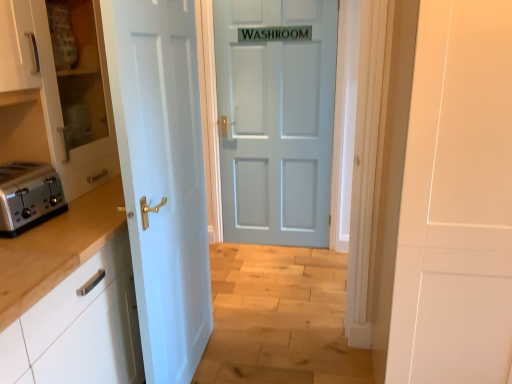
Question: Is white glossy cabinet at left, acting as the second cabinetry starting from the top, shorter than light blue matte door at center, the 2th door positioned from the front?

Choices:
 (A) yes
 (B) no

Answer: (A)

Question: Does white glossy cabinet at left, the 1th cabinetry ordered from the bottom, have a greater height compared to light blue matte door at center, placed as the second door when sorted from left to right?

Choices:
 (A) no
 (B) yes

Answer: (A)

Question: Is white glossy cabinet at left, acting as the second cabinetry starting from the top, oriented away from light blue matte door at center, placed as the second door when sorted from left to right?

Choices:
 (A) no
 (B) yes

Answer: (A)

Question: Can light blue matte door at center, positioned as the 1th door in right-to-left order, be found inside white glossy cabinet at left, acting as the second cabinetry starting from the top?

Choices:
 (A) no
 (B) yes

Answer: (A)

Question: Is white glossy cabinet at left, acting as the second cabinetry starting from the top, beside light blue matte door at center, the 2th door positioned from the front?

Choices:
 (A) no
 (B) yes

Answer: (A)

Question: Is white glossy cabinet at left, the 1th cabinetry ordered from the bottom, to the left of light blue matte door at center, positioned as the 1th door in right-to-left order, from the viewer's perspective?

Choices:
 (A) no
 (B) yes

Answer: (B)

Question: Is light blue matte door at center, placed as the second door when sorted from left to right, looking in the opposite direction of satin silver toaster at left?

Choices:
 (A) no
 (B) yes

Answer: (A)

Question: From the image's perspective, would you say light blue matte door at center, positioned as the 1th door in right-to-left order, is positioned over satin silver toaster at left?

Choices:
 (A) no
 (B) yes

Answer: (B)

Question: Would you say satin silver toaster at left is part of light blue matte door at center, positioned as the 1th door in right-to-left order,'s contents?

Choices:
 (A) no
 (B) yes

Answer: (A)

Question: Considering the relative sizes of light blue matte door at center, placed as the second door when sorted from left to right, and satin silver toaster at left in the image provided, is light blue matte door at center, placed as the second door when sorted from left to right, wider than satin silver toaster at left?

Choices:
 (A) no
 (B) yes

Answer: (A)

Question: Would you consider light blue matte door at center, placed as the second door when sorted from left to right, to be distant from satin silver toaster at left?

Choices:
 (A) no
 (B) yes

Answer: (B)

Question: Can you confirm if light blue matte door at center, placed as the second door when sorted from left to right, is shorter than satin silver toaster at left?

Choices:
 (A) yes
 (B) no

Answer: (B)

Question: Is white painted wood door at left, which ranks as the first door in front-to-back order, at the back of white glossy cabinet at left, the first cabinetry in the top-to-bottom sequence?

Choices:
 (A) yes
 (B) no

Answer: (B)